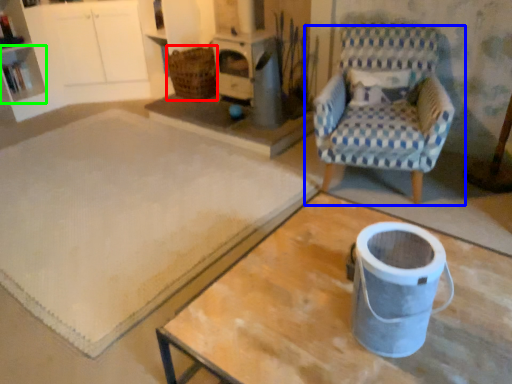
Question: Which is farther away from basket (highlighted by a red box)? chair (highlighted by a blue box) or shelf (highlighted by a green box)?

Choices:
 (A) chair
 (B) shelf

Answer: (A)